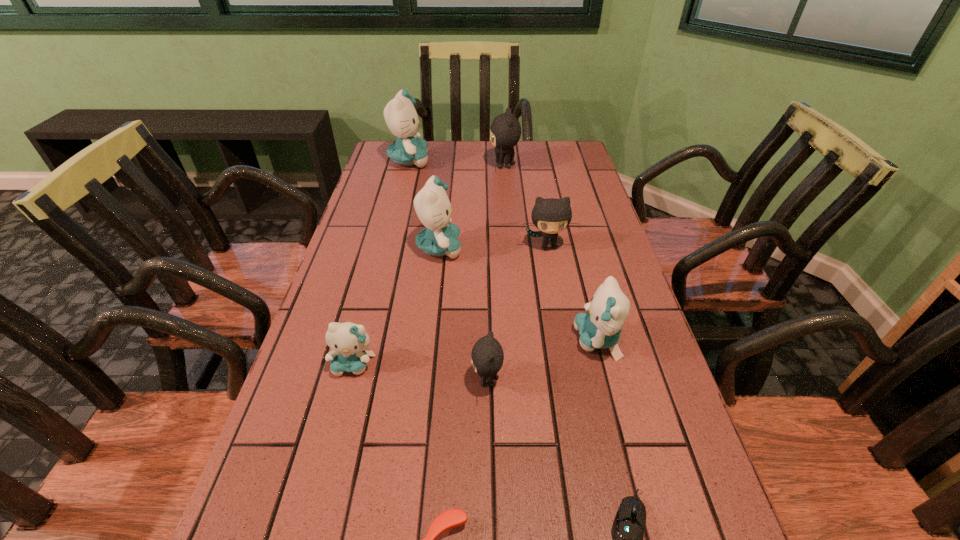
The width and height of the screenshot is (960, 540). Find the location of `vacant space located on the front-facing side of the smallest gray kitten`. vacant space located on the front-facing side of the smallest gray kitten is located at coordinates (420, 380).

Identify the location of vacant position located on the front-facing side of the smallest gray kitten. The width and height of the screenshot is (960, 540). coord(385,380).

Locate an element on the screen. object that is at the far left corner is located at coordinates (400, 115).

The image size is (960, 540). Identify the location of vacant space at the left edge. (411, 205).

This screenshot has height=540, width=960. In the image, there is a desktop. Find the location of `vacant space at the right edge`. vacant space at the right edge is located at coordinates (567, 302).

Identify the location of free location at the far right corner. The height and width of the screenshot is (540, 960). (539, 166).

The image size is (960, 540). In order to click on free spot between the third smallest blue kitten and the smallest blue kitten in this screenshot , I will do `click(396, 306)`.

The width and height of the screenshot is (960, 540). What are the coordinates of `free space that is in between the smallest gray kitten and the biggest gray kitten` in the screenshot? It's located at (495, 273).

The image size is (960, 540). Identify the location of vacant point located between the rightmost blue kitten and the farthest blue kitten. (503, 251).

Identify the location of free space between the second farthest gray kitten and the farthest gray kitten. The width and height of the screenshot is (960, 540). (526, 206).